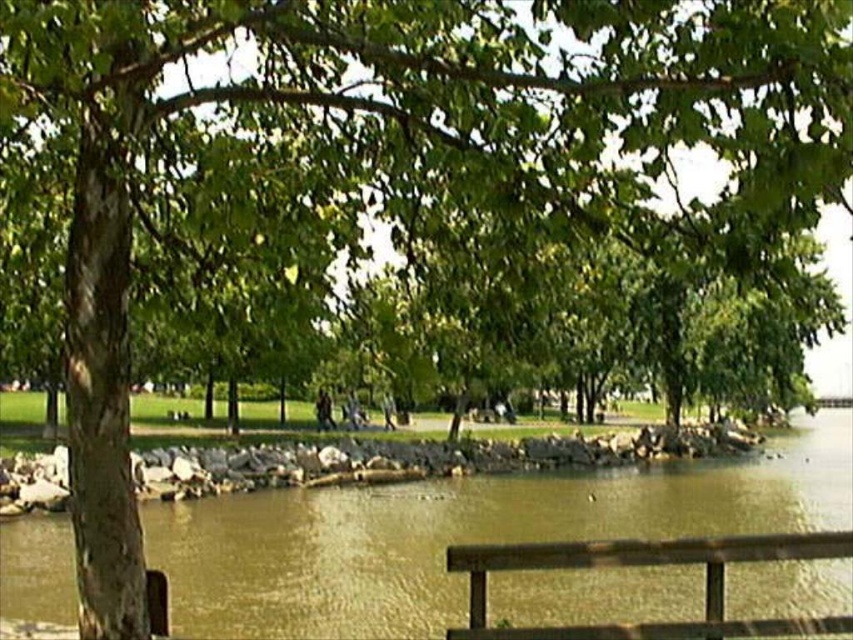
In the scene shown: Can you confirm if brown sedimentary rock at center is taller than brown wooden bench at lower right?

Correct, brown sedimentary rock at center is much taller as brown wooden bench at lower right.

Who is positioned more to the left, brown sedimentary rock at center or brown wooden bench at lower right?

From the viewer's perspective, brown wooden bench at lower right appears more on the left side.

Between point (811, 602) and point (482, 621), which one is positioned behind?

Positioned behind is point (811, 602).

The width and height of the screenshot is (853, 640). I want to click on brown sedimentary rock at center, so click(x=461, y=534).